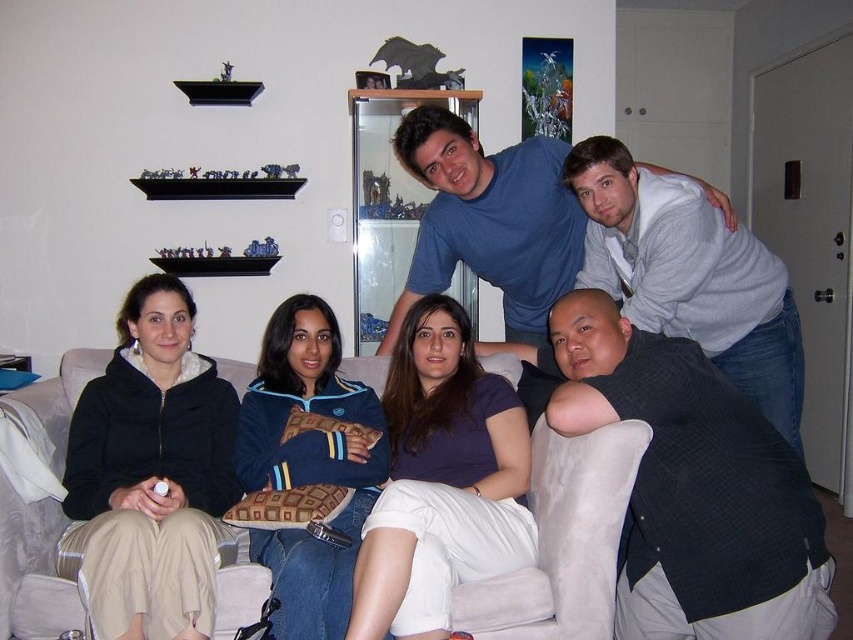
Between black textured vest at lower right and beige fabric couch at center, which one has more height?

Standing taller between the two is black textured vest at lower right.

This screenshot has height=640, width=853. I want to click on black textured vest at lower right, so click(x=694, y=486).

Is black textured vest at lower right bigger than blue cotton shirt at upper center?

No, black textured vest at lower right is not bigger than blue cotton shirt at upper center.

Does black textured vest at lower right have a greater width compared to blue cotton shirt at upper center?

No, black textured vest at lower right is not wider than blue cotton shirt at upper center.

Is point (714, 540) less distant than point (457, 193)?

That is True.

This screenshot has height=640, width=853. Find the location of `black textured vest at lower right`. black textured vest at lower right is located at coordinates (694, 486).

Can you confirm if black textured vest at lower right is smaller than gray sweater at upper right?

Indeed, black textured vest at lower right has a smaller size compared to gray sweater at upper right.

Between point (799, 481) and point (691, 184), which one is positioned in front?

Point (799, 481) is more forward.

Measure the distance between point (695, 520) and camera.

5.42 feet

Find the location of a particular element. This screenshot has height=640, width=853. black textured vest at lower right is located at coordinates (694, 486).